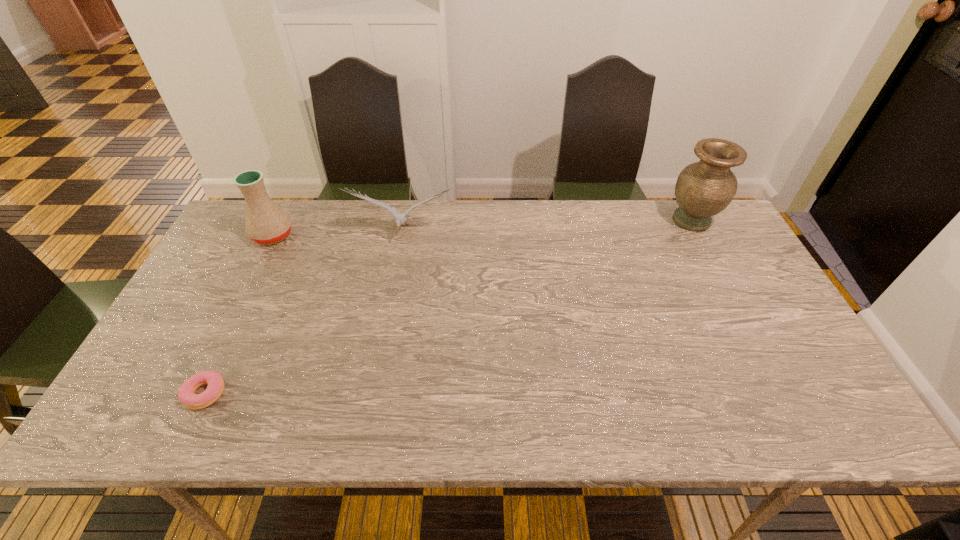
I want to click on object situated at the far right corner, so click(703, 189).

This screenshot has width=960, height=540. In the image, there is a desktop. Identify the location of vacant space at the far edge. (346, 220).

What are the coordinates of `vacant region at the near edge of the desktop` in the screenshot? It's located at (558, 409).

Locate an element on the screen. The height and width of the screenshot is (540, 960). vacant area at the left edge of the desktop is located at coordinates (146, 371).

Find the location of `vacant area at the far right corner of the desktop`. vacant area at the far right corner of the desktop is located at coordinates point(715,230).

Identify the location of vacant area that lies between the nearest object and the pottery. The height and width of the screenshot is (540, 960). (239, 314).

Locate an element on the screen. free space between the tallest object and the nearest object is located at coordinates (448, 307).

Locate an element on the screen. free spot between the nearest object and the third object from left to right is located at coordinates (304, 313).

What are the coordinates of `vacant space that's between the third shortest object and the second object from right to left` in the screenshot? It's located at (338, 234).

Locate an element on the screen. Image resolution: width=960 pixels, height=540 pixels. empty space that is in between the nearest object and the third object from left to right is located at coordinates (304, 313).